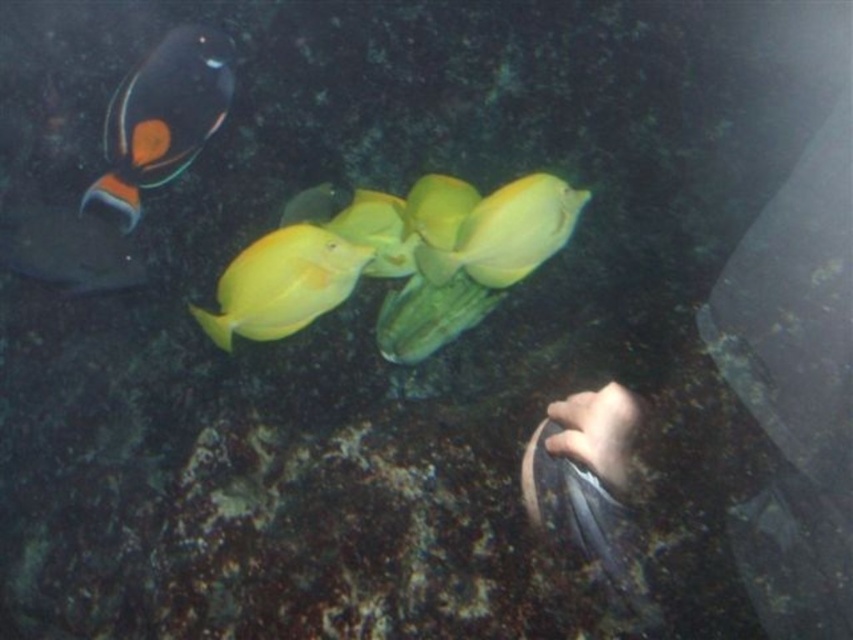
You are a marine biologist observing the underwater scene. You notice two fish species present. The shiny yellow fish at center is part of a group, while the shiny black fish at left is alone. Based on their sizes, which fish would you estimate to be smaller?

The shiny yellow fish at center has a lesser height compared to the shiny black fish at left, so the shiny yellow fish at center is smaller in height.

You are a marine biologist observing the underwater scene. You need to locate the orange and black textured fish at upper left. According to the coordinates provided, where exactly is this fish positioned in the image?

The orange and black textured fish at upper left is positioned at the coordinates point (x=163, y=115).

You are a marine biologist studying fish behavior underwater. You observe a yellow matte fish at center in the image. What are the coordinates of its position in the image?

The coordinates of the yellow matte fish at center are at point (508,232).